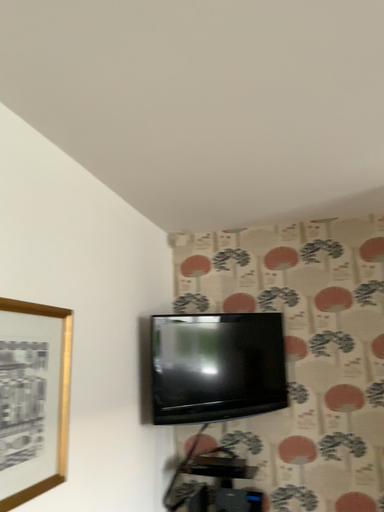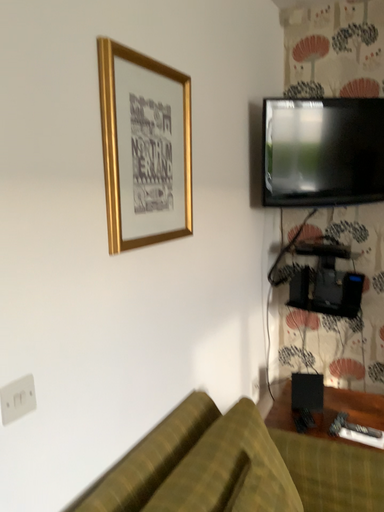
Question: Which way did the camera rotate in the video?

Choices:
 (A) rotated downward
 (B) rotated upward

Answer: (A)